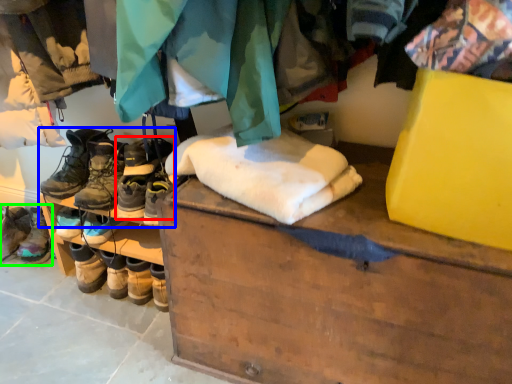
Question: Which object is the closest to the footwear (highlighted by a red box)? Choose among these: footwear (highlighted by a blue box) or footwear (highlighted by a green box).

Choices:
 (A) footwear
 (B) footwear

Answer: (A)